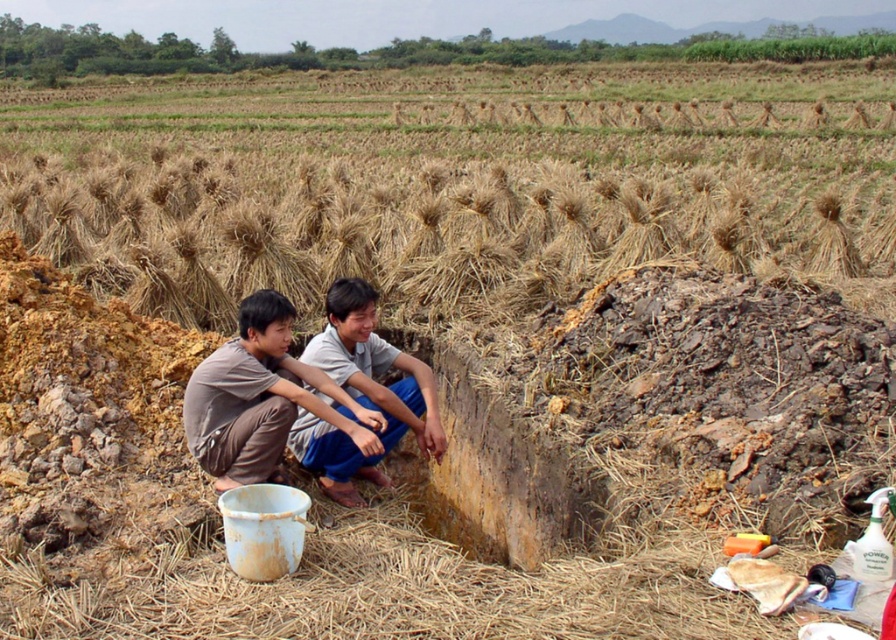
You are a farmer who needs to retrieve the bottle near the trench. You are currently standing at the edge of the trench. Which object, the brown cotton shirt at center or the brown straw at center, would you have to move first to access the bottle?

The brown cotton shirt at center is behind the brown straw at center, so you would need to move the brown straw at center first to access the bottle.

You are a photographer standing at the camera position. You want to pick up the brown straw at center to use as a prop for a photo shoot. Can you reach it without moving from your current position?

The brown straw at center is 5.71 meters away from the camera, so you cannot reach it without moving from your current position.